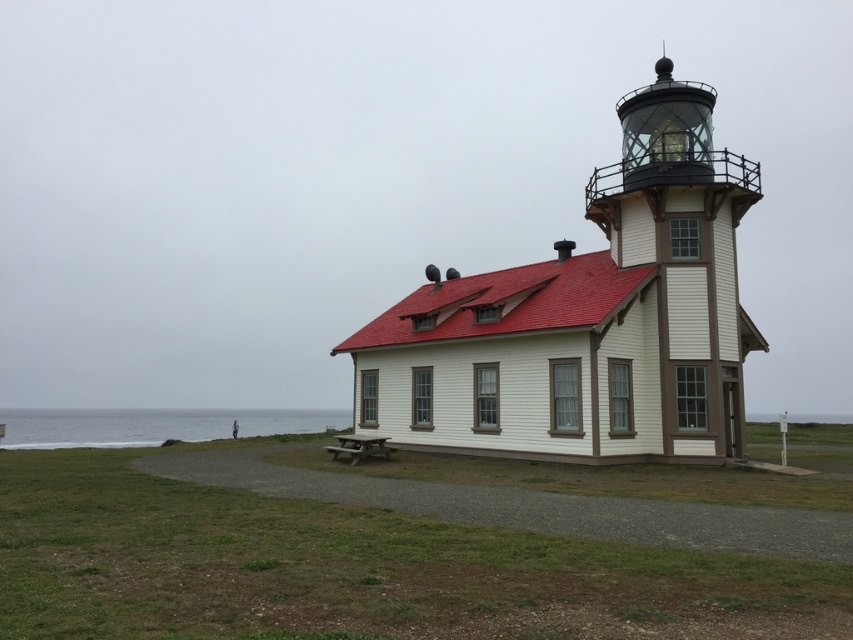
You are standing at the entrance of the gravel path leading to the lighthouse. You see the matte white tower at center and the wooden picnic table at center. Which object is closer to you?

The matte white tower at center is closer to you because it is positioned in front of the wooden picnic table at center.

You are planning to set up a small tent at the wooden picnic table at center for a coastal event. Considering the gray water at lower left is the ocean, how far in feet would the tent be from the ocean?

The distance between the gray water at lower left and wooden picnic table at center is 129.08 feet, so the tent would be 129.08 feet away from the ocean.